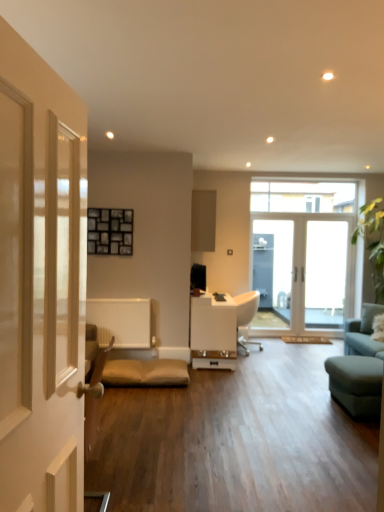
Describe the element at coordinates (41, 282) in the screenshot. This screenshot has height=512, width=384. I see `white glossy door at left` at that location.

The width and height of the screenshot is (384, 512). Describe the element at coordinates (303, 197) in the screenshot. I see `clear glass window at upper center, which is the second window in bottom-to-top order` at that location.

You are a GUI agent. You are given a task and a screenshot of the screen. Output one action in this format:
    pyautogui.click(x=<x>, y=<y>)
    Task: Click on the white glass door at center, which appears as the first window when ordered from the bottom
    The image size is (384, 512).
    Given the screenshot: What is the action you would take?
    [x=309, y=249]

Image resolution: width=384 pixels, height=512 pixels. Describe the element at coordinates (203, 221) in the screenshot. I see `matte wood cabinet at center` at that location.

In order to face transparent glass door at center, should I rotate leftwards or rightwards?

It's best to rotate right around 17.661 degrees.

This screenshot has height=512, width=384. I want to click on teal fabric studio couch at right, so click(358, 367).

Where is `white glossy door at left`? white glossy door at left is located at coordinates (41, 282).

Is transparent glass door at center positioned in front of white plastic chair at center?

No.

Where is `chair located in front of the transparent glass door at center`? The height and width of the screenshot is (512, 384). chair located in front of the transparent glass door at center is located at coordinates (246, 316).

Are transparent glass door at center and white plastic chair at center making contact?

No, transparent glass door at center is not next to white plastic chair at center.

Which object is positioned more to the left, teal fabric studio couch at right or white plastic chair at center?

Positioned to the left is white plastic chair at center.

Which of these two, teal fabric studio couch at right or white plastic chair at center, is smaller?

With smaller size is white plastic chair at center.

From the image's perspective, which one is positioned higher, teal fabric studio couch at right or white plastic chair at center?

white plastic chair at center appears higher in the image.

Is white glass door at center, the 2th window when ordered from top to bottom, completely or partially inside clear glass window at upper center, which is the second window in bottom-to-top order?

No, clear glass window at upper center, which is the second window in bottom-to-top order, does not contain white glass door at center, the 2th window when ordered from top to bottom.

From the image's perspective, is clear glass window at upper center, which is the second window in bottom-to-top order, on white glass door at center, which appears as the first window when ordered from the bottom?

Correct, clear glass window at upper center, which is the second window in bottom-to-top order, appears higher than white glass door at center, which appears as the first window when ordered from the bottom, in the image.

From a real-world perspective, is clear glass window at upper center, which is the 1th window from top to bottom, on top of white glass door at center, which appears as the first window when ordered from the bottom?

Correct, in the physical world, clear glass window at upper center, which is the 1th window from top to bottom, is higher than white glass door at center, which appears as the first window when ordered from the bottom.

Which of these two, clear glass window at upper center, which is the 1th window from top to bottom, or white glass door at center, which appears as the first window when ordered from the bottom, is wider?

Wider between the two is white glass door at center, which appears as the first window when ordered from the bottom.

In terms of size, does white glossy door at left appear bigger or smaller than clear glass window at upper center, which is the second window in bottom-to-top order?

white glossy door at left is bigger than clear glass window at upper center, which is the second window in bottom-to-top order.

Which is closer, (25, 241) or (351, 199)?

Clearly, point (25, 241) is closer to the camera than point (351, 199).

How different are the orientations of white glossy door at left and clear glass window at upper center, which is the second window in bottom-to-top order, in degrees?

The angle between the facing direction of white glossy door at left and the facing direction of clear glass window at upper center, which is the second window in bottom-to-top order, is 88.3 degrees.

Locate an element on the screen. door on the left of clear glass window at upper center, which is the second window in bottom-to-top order is located at coordinates (41, 282).

Considering the relative sizes of teal fabric studio couch at right and clear glass window at upper center, which is the 1th window from top to bottom, in the image provided, is teal fabric studio couch at right wider than clear glass window at upper center, which is the 1th window from top to bottom,?

Yes, teal fabric studio couch at right is wider than clear glass window at upper center, which is the 1th window from top to bottom.

Which object is positioned more to the right, teal fabric studio couch at right or clear glass window at upper center, which is the second window in bottom-to-top order?

teal fabric studio couch at right.

Does teal fabric studio couch at right turn towards clear glass window at upper center, which is the 1th window from top to bottom?

No, teal fabric studio couch at right does not turn towards clear glass window at upper center, which is the 1th window from top to bottom.

Is teal fabric studio couch at right shorter than clear glass window at upper center, which is the 1th window from top to bottom?

No.

Which is further, (x=329, y=274) or (x=317, y=206)?

The point (x=317, y=206) is behind.

Considering the sizes of objects transparent glass door at center and clear glass window at upper center, which is the second window in bottom-to-top order, in the image provided, who is bigger, transparent glass door at center or clear glass window at upper center, which is the second window in bottom-to-top order,?

transparent glass door at center.

Considering the relative positions of transparent glass door at center and clear glass window at upper center, which is the second window in bottom-to-top order, in the image provided, is transparent glass door at center behind clear glass window at upper center, which is the second window in bottom-to-top order,?

No, transparent glass door at center is in front of clear glass window at upper center, which is the second window in bottom-to-top order.

How distant is transparent glass door at center from clear glass window at upper center, which is the second window in bottom-to-top order?

30.78 inches.

Where is `cabinetry that appears above the white glossy door at left (from the image's perspective)`? The image size is (384, 512). cabinetry that appears above the white glossy door at left (from the image's perspective) is located at coordinates 203,221.

Can you tell me how much matte wood cabinet at center and white glossy door at left differ in facing direction?

They differ by 2.03 degrees in their facing directions.

From a real-world perspective, which is physically below, matte wood cabinet at center or white glossy door at left?

white glossy door at left.

Identify the location of window screen above the white plastic chair at center (from the image's perspective). (325, 274).

This screenshot has height=512, width=384. Identify the location of studio couch to the right of white plastic chair at center. (358, 367).

When comparing their distances from white glass door at center, which appears as the first window when ordered from the bottom, does white glossy door at left or matte wood cabinet at center seem closer?

matte wood cabinet at center.

Looking at the image, which one is located further to white glass door at center, the 2th window when ordered from top to bottom, teal fabric studio couch at right or white plastic chair at center?

Based on the image, teal fabric studio couch at right appears to be further to white glass door at center, the 2th window when ordered from top to bottom.

From the image, which object appears to be nearer to teal fabric studio couch at right, matte wood cabinet at center or white glossy table at center?

Based on the image, white glossy table at center appears to be nearer to teal fabric studio couch at right.

Based on their spatial positions, is white glossy table at center or white plastic chair at center further from matte wood cabinet at center?

white glossy table at center.

Which object lies further to the anchor point transparent glass door at center, white glass door at center, which appears as the first window when ordered from the bottom, or clear glass window at upper center, which is the 1th window from top to bottom?

clear glass window at upper center, which is the 1th window from top to bottom.

Which object lies nearer to the anchor point white glass door at center, the 2th window when ordered from top to bottom, white glossy door at left or clear glass window at upper center, which is the second window in bottom-to-top order?

clear glass window at upper center, which is the second window in bottom-to-top order, is closer to white glass door at center, the 2th window when ordered from top to bottom.

Estimate the real-world distances between objects in this image. Which object is further from transparent glass door at center, matte wood cabinet at center or white glossy table at center?

Among the two, white glossy table at center is located further to transparent glass door at center.

From the image, which object appears to be nearer to transparent glass door at center, matte wood cabinet at center or white plastic chair at center?

white plastic chair at center lies closer to transparent glass door at center than the other object.

You are a GUI agent. You are given a task and a screenshot of the screen. Output one action in this format:
    pyautogui.click(x=<x>, y=<y>)
    Task: Click on the studio couch between white glossy door at left and white plastic chair at center from front to back
    
    Given the screenshot: What is the action you would take?
    pyautogui.click(x=358, y=367)

Locate an element on the screen. Image resolution: width=384 pixels, height=512 pixels. chair between white glossy door at left and transparent glass door at center in the front-back direction is located at coordinates (246, 316).

The image size is (384, 512). Find the location of `cabinetry that lies between clear glass window at upper center, which is the 1th window from top to bottom, and white plastic chair at center from top to bottom`. cabinetry that lies between clear glass window at upper center, which is the 1th window from top to bottom, and white plastic chair at center from top to bottom is located at coordinates (203, 221).

You are a GUI agent. You are given a task and a screenshot of the screen. Output one action in this format:
    pyautogui.click(x=<x>, y=<y>)
    Task: Click on the table between teal fabric studio couch at right and transparent glass door at center in the front-back direction
    The height and width of the screenshot is (512, 384).
    Given the screenshot: What is the action you would take?
    pyautogui.click(x=213, y=332)